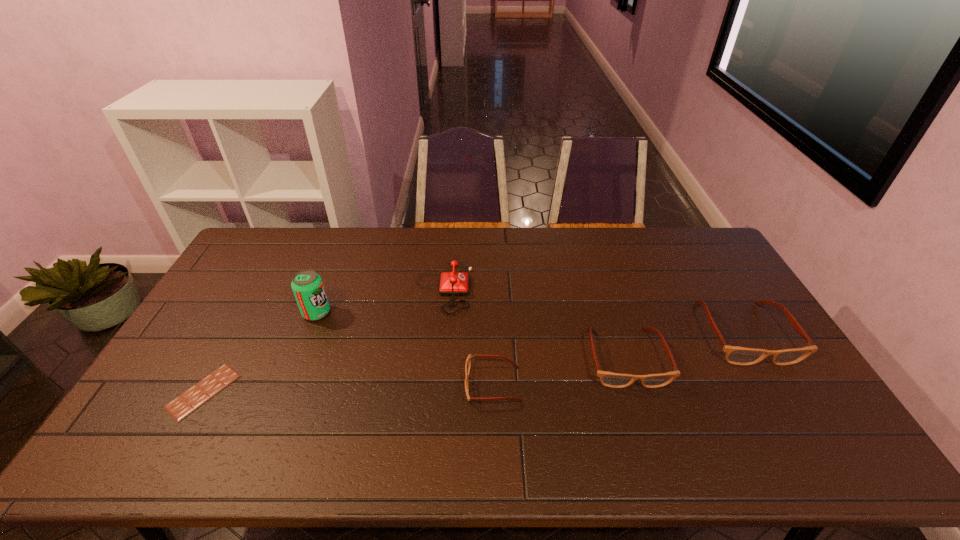
Choose which object is the second nearest neighbor to the second object from right to left. Please provide its 2D coordinates. Your answer should be formatted as a tuple, i.e. [(x, y)], where the tuple contains the x and y coordinates of a point satisfying the conditions above.

[(468, 361)]

Where is `object that ranks as the second closest to the leftmost object`? object that ranks as the second closest to the leftmost object is located at coordinates (452, 283).

You are a GUI agent. You are given a task and a screenshot of the screen. Output one action in this format:
    pyautogui.click(x=<x>, y=<y>)
    Task: Click on the closest spectacles to the fifth object from left to right
    The image size is (960, 540).
    Given the screenshot: What is the action you would take?
    pyautogui.click(x=736, y=355)

Find the location of a particular element. The width and height of the screenshot is (960, 540). spectacles that is the closest one to the rightmost object is located at coordinates pos(609,379).

Where is `vacant space that satisfies the following two spatial constraints: 1. on the front-facing side of the leftmost spectacles; 2. on the front side of the shortest object`? The width and height of the screenshot is (960, 540). vacant space that satisfies the following two spatial constraints: 1. on the front-facing side of the leftmost spectacles; 2. on the front side of the shortest object is located at coordinates (493, 392).

I want to click on vacant point that satisfies the following two spatial constraints: 1. on the front-facing side of the tallest object; 2. on the front side of the chocolate bar, so click(286, 392).